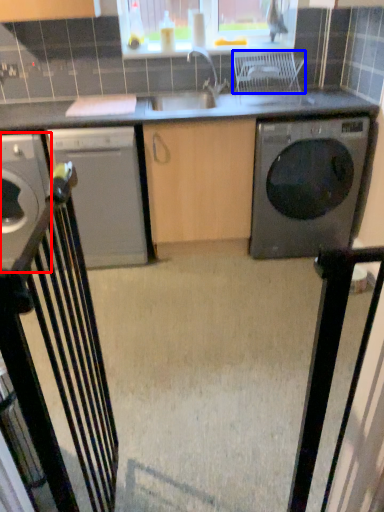
Question: Which point is closer to the camera, home appliance (highlighted by a red box) or chair (highlighted by a blue box)?

Choices:
 (A) home appliance
 (B) chair

Answer: (B)